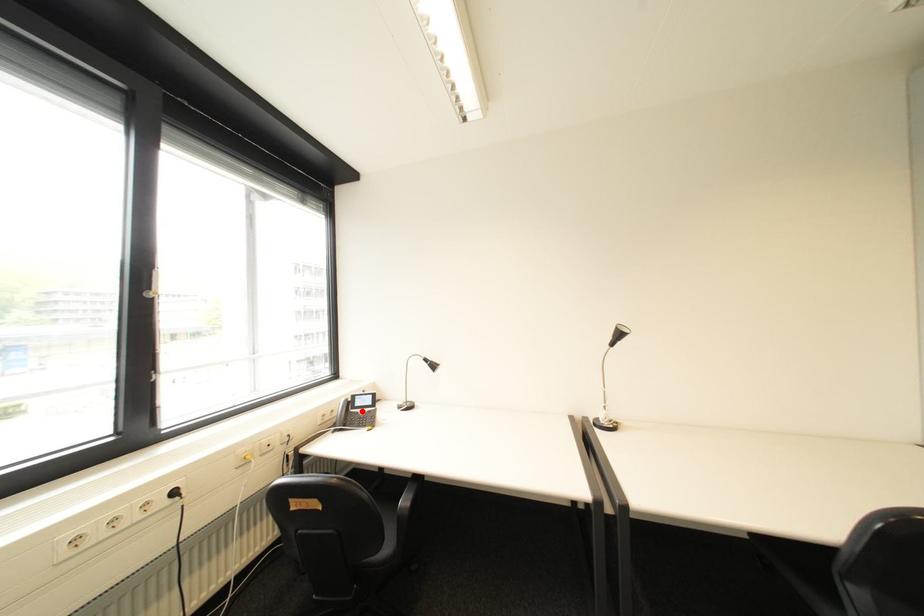
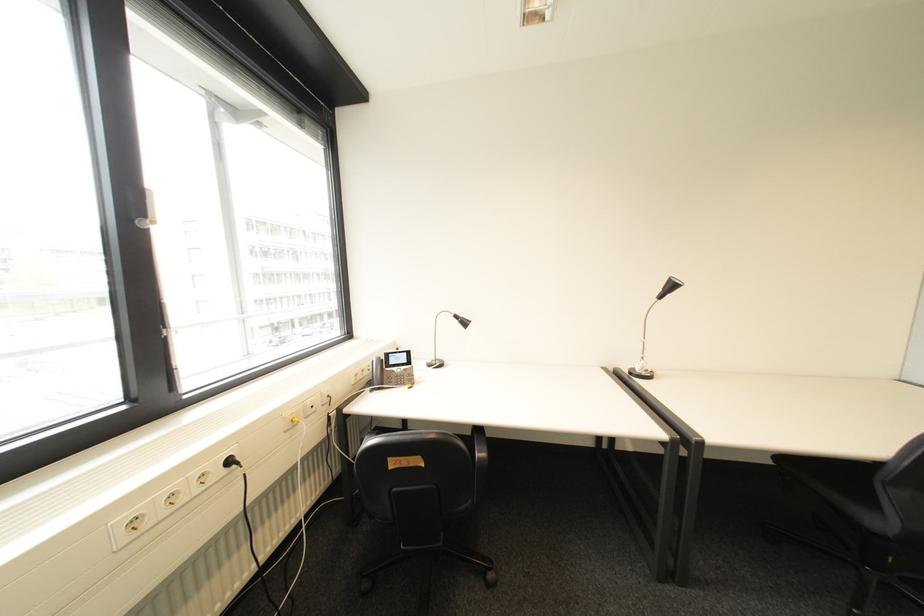
Locate, in the second image, the point that corresponds to the highlighted location in the first image.

(396, 370)